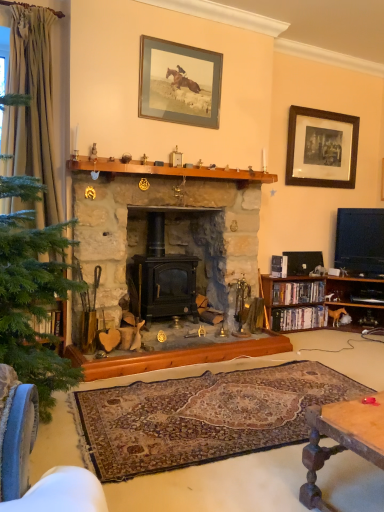
In order to click on free space above matte glass picture frame at upper center, arranged as the 1th picture frame when viewed from the front (from a real-world perspective) in this screenshot , I will do `click(181, 44)`.